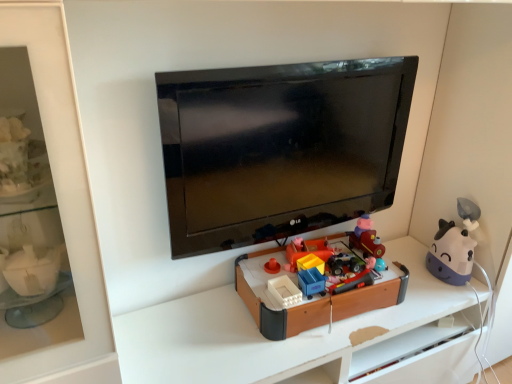
Where is `vacant space situated on the left part of rubberized plastic toy car at center, the fourth toy when ordered from left to right`? This screenshot has width=512, height=384. vacant space situated on the left part of rubberized plastic toy car at center, the fourth toy when ordered from left to right is located at coordinates (288, 268).